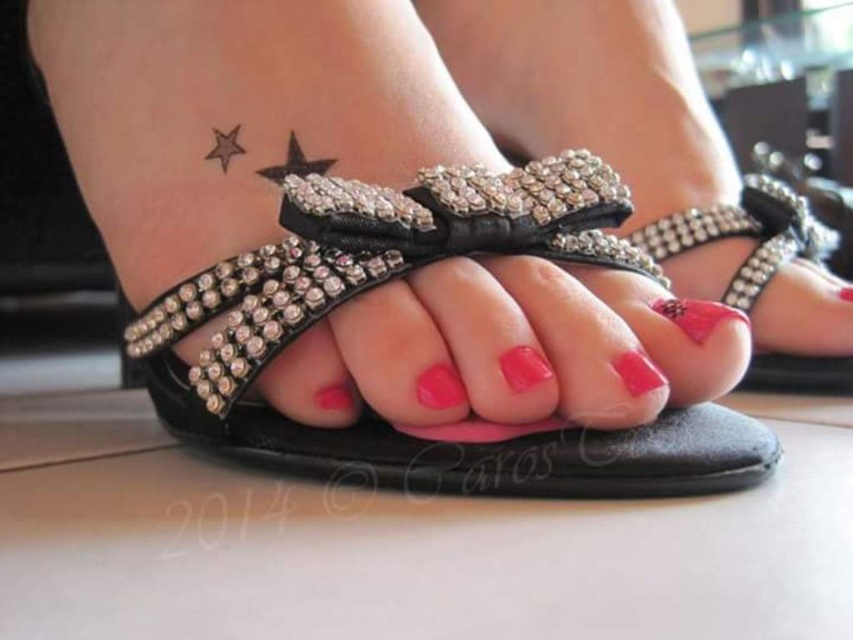
Question: Which is nearer to the pink glossy nail at center?

Choices:
 (A) glossy pink nail at center
 (B) matte black sandals at center
 (C) black leather sandal at center

Answer: (A)

Question: Is black leather sandal at center to the right of pink glossy nail at center from the viewer's perspective?

Choices:
 (A) no
 (B) yes

Answer: (A)

Question: Is pink glossy nail at center above glossy pink nail at center?

Choices:
 (A) yes
 (B) no

Answer: (B)

Question: Considering the real-world distances, which object is farthest from the black leather sandal at center?

Choices:
 (A) glossy pink nail at center
 (B) matte black sandals at center

Answer: (B)

Question: Does black leather sandal at center appear on the left side of glossy pink nail at center?

Choices:
 (A) yes
 (B) no

Answer: (A)

Question: Which of the following is the farthest from the observer?

Choices:
 (A) (543, 381)
 (B) (392, 276)
 (C) (463, 394)
 (D) (640, 161)

Answer: (D)